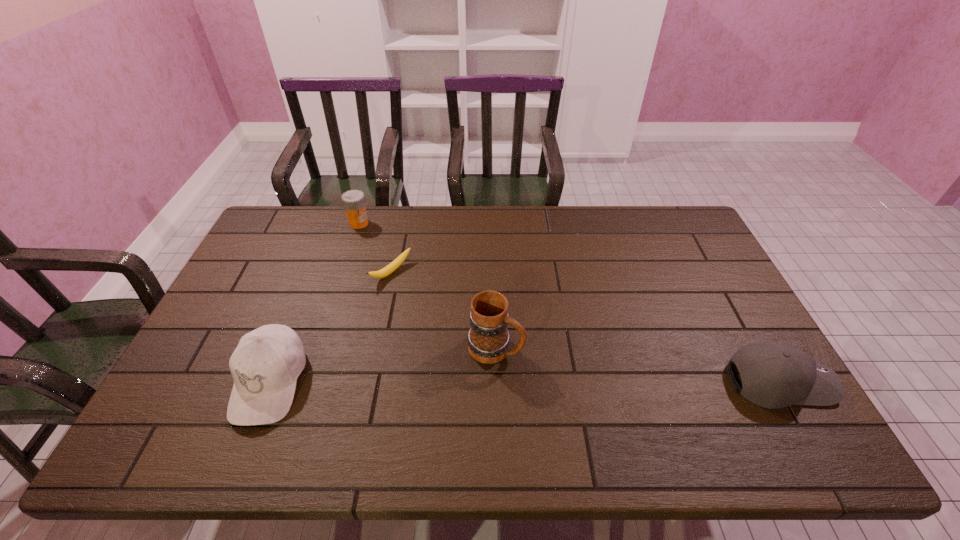
In order to click on object that is positioned at the near right corner in this screenshot , I will do `click(774, 375)`.

Where is `vacant space at the far edge of the desktop`? The height and width of the screenshot is (540, 960). vacant space at the far edge of the desktop is located at coordinates (391, 231).

This screenshot has height=540, width=960. In the image, there is a desktop. In order to click on vacant space at the near edge in this screenshot , I will do `click(449, 399)`.

Identify the location of blank space at the left edge. This screenshot has height=540, width=960. (276, 297).

At what (x,y) coordinates should I click in order to perform the action: click on vacant space at the right edge of the desktop. Please return your answer as a coordinate pair (x, y). Looking at the image, I should click on (722, 336).

The image size is (960, 540). I want to click on vacant space at the far left corner, so click(265, 236).

Locate an element on the screen. The image size is (960, 540). free space at the near left corner of the desktop is located at coordinates (180, 389).

What are the coordinates of `vacant space at the near right corner of the desktop` in the screenshot? It's located at (728, 399).

Where is `free spot between the fourth nearest object and the left baseball cap`? The image size is (960, 540). free spot between the fourth nearest object and the left baseball cap is located at coordinates (330, 327).

Locate an element on the screen. This screenshot has height=540, width=960. free spot between the fourth object from left to right and the second farthest object is located at coordinates (444, 310).